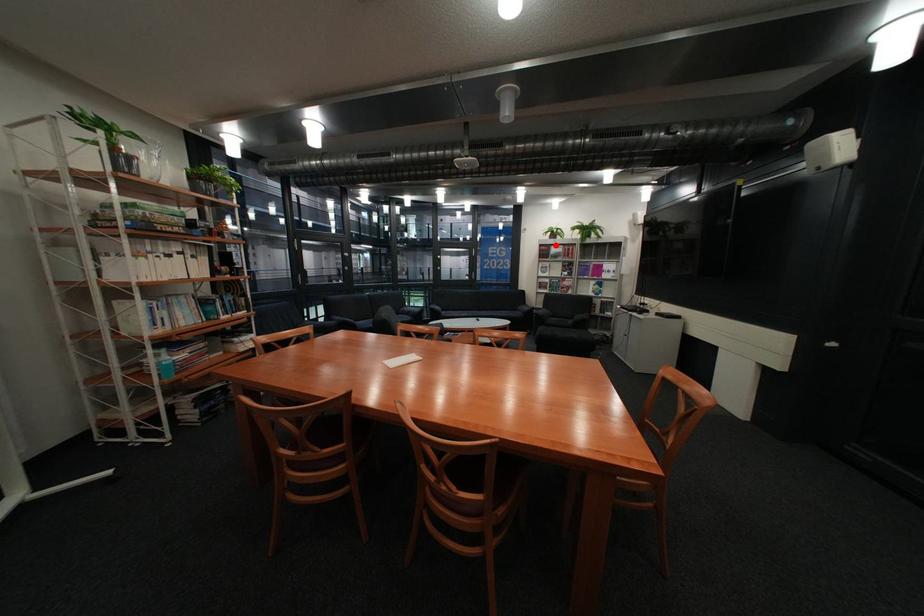
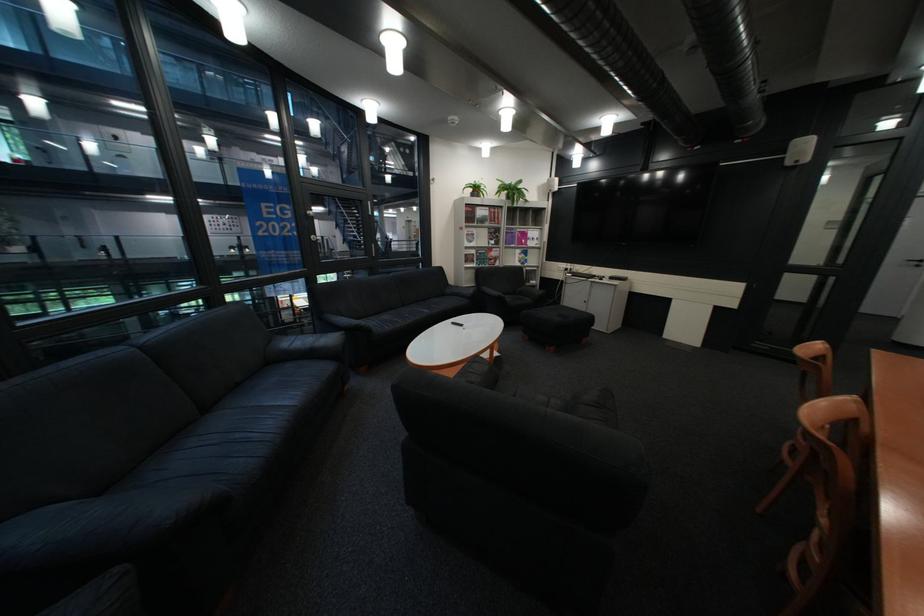
Where in the second image is the point corresponding to the highlighted location from the first image?

(481, 205)